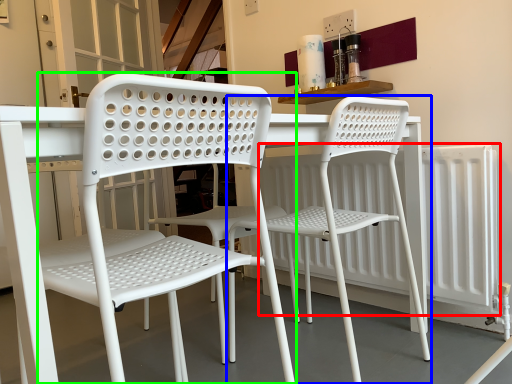
Question: Which object is the closest to the radiator (highlighted by a red box)? Choose among these: chair (highlighted by a blue box) or chair (highlighted by a green box).

Choices:
 (A) chair
 (B) chair

Answer: (A)